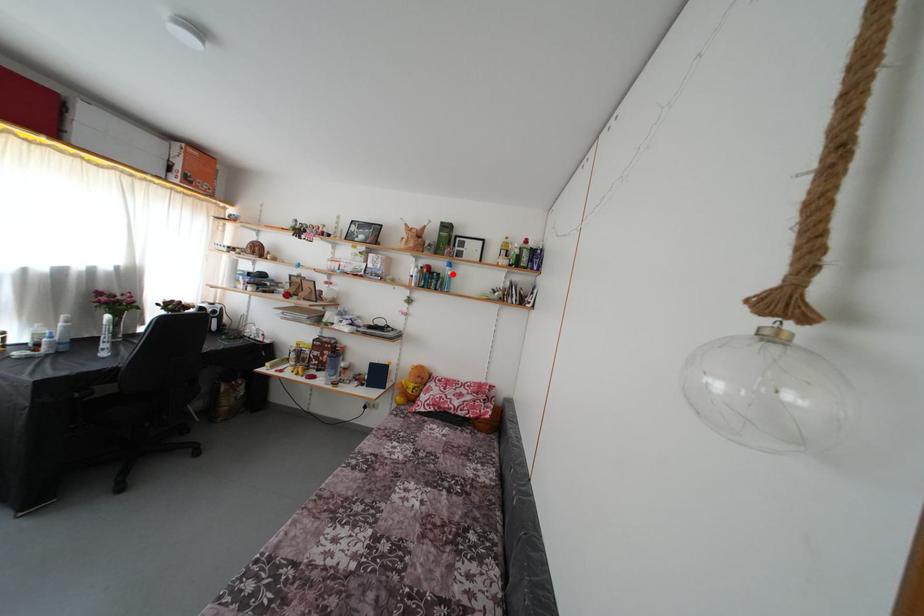
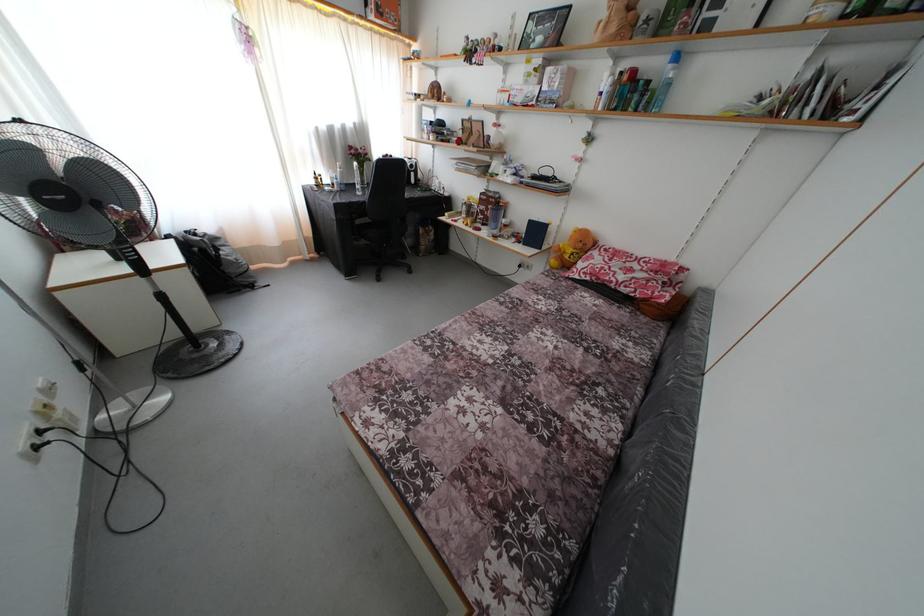
The point at the highlighted location is marked in the first image. Where is the corresponding point in the second image?

(675, 73)